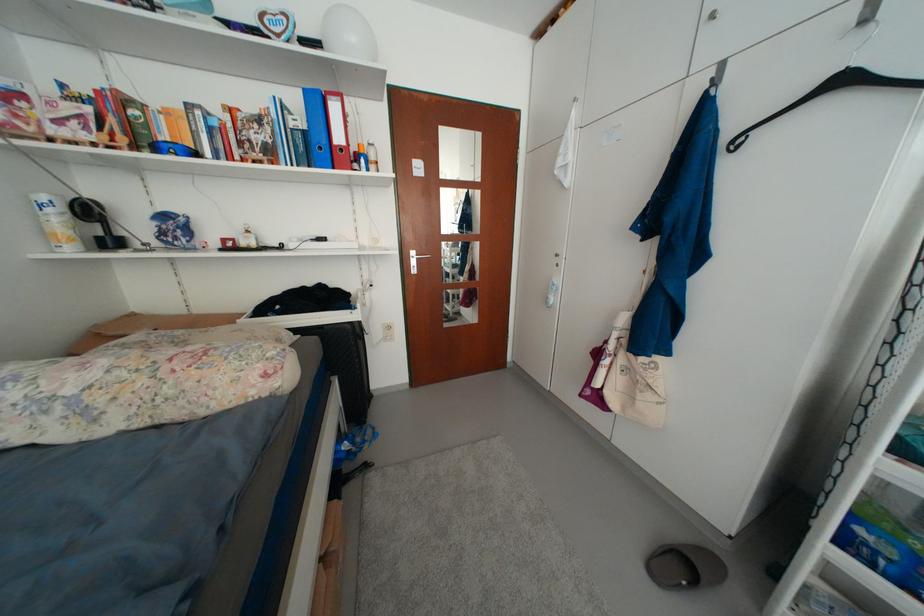
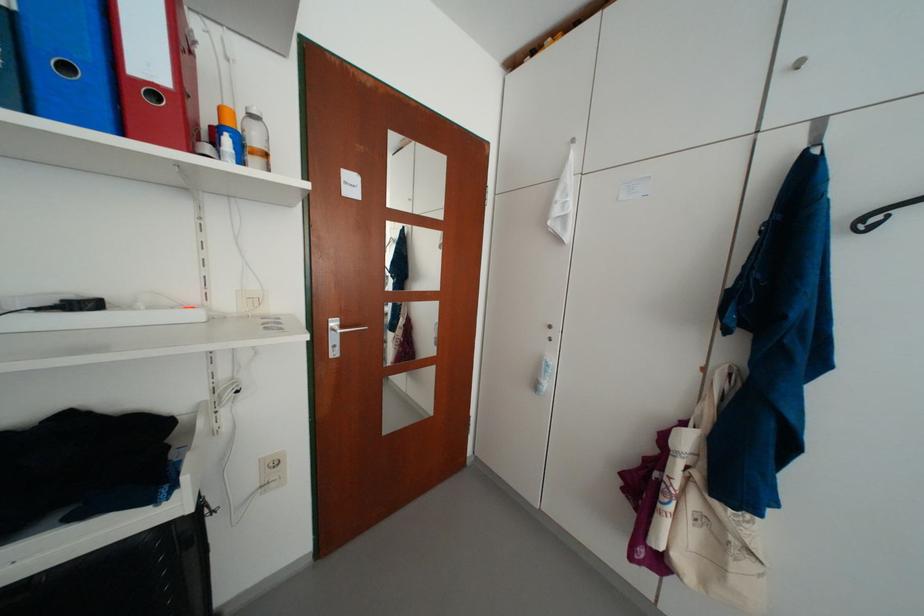
Where in the second image is the point corresponding to pixel 373 244 from the first image?

(236, 306)